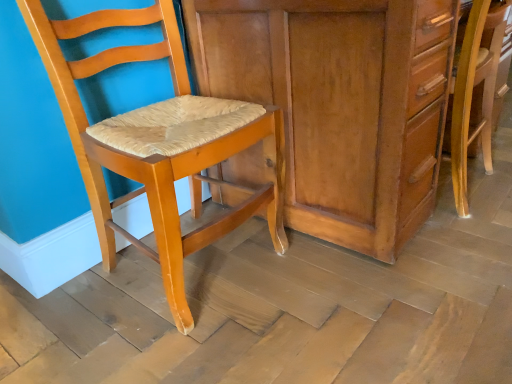
Question: Is matte wood chair at left, positioned as the second chair in right-to-left order, at the left side of wooden chair at right, the first chair in the right-to-left sequence?

Choices:
 (A) no
 (B) yes

Answer: (B)

Question: Is matte wood chair at left, the 1th chair when ordered from left to right, positioned beyond the bounds of wooden chair at right, the first chair in the right-to-left sequence?

Choices:
 (A) yes
 (B) no

Answer: (A)

Question: Can you confirm if matte wood chair at left, the 1th chair when ordered from left to right, is wider than wooden chair at right, acting as the 2th chair starting from the left?

Choices:
 (A) yes
 (B) no

Answer: (A)

Question: Does matte wood chair at left, the 1th chair when ordered from left to right, have a lesser height compared to wooden chair at right, acting as the 2th chair starting from the left?

Choices:
 (A) yes
 (B) no

Answer: (B)

Question: Does matte wood chair at left, positioned as the second chair in right-to-left order, lie in front of wooden chair at right, acting as the 2th chair starting from the left?

Choices:
 (A) yes
 (B) no

Answer: (A)

Question: Does matte wood chair at left, positioned as the second chair in right-to-left order, have a greater height compared to wooden chair at right, the first chair in the right-to-left sequence?

Choices:
 (A) no
 (B) yes

Answer: (B)

Question: Is wooden chair at right, the first chair in the right-to-left sequence, at the right side of matte wood cabinet at center?

Choices:
 (A) no
 (B) yes

Answer: (B)

Question: Is wooden chair at right, acting as the 2th chair starting from the left, looking in the opposite direction of matte wood cabinet at center?

Choices:
 (A) no
 (B) yes

Answer: (B)

Question: Is wooden chair at right, acting as the 2th chair starting from the left, surrounding matte wood cabinet at center?

Choices:
 (A) yes
 (B) no

Answer: (B)

Question: Does wooden chair at right, the first chair in the right-to-left sequence, have a larger size compared to matte wood cabinet at center?

Choices:
 (A) no
 (B) yes

Answer: (A)

Question: Can you confirm if wooden chair at right, acting as the 2th chair starting from the left, is taller than matte wood cabinet at center?

Choices:
 (A) yes
 (B) no

Answer: (B)

Question: Considering the relative sizes of wooden chair at right, acting as the 2th chair starting from the left, and matte wood cabinet at center in the image provided, is wooden chair at right, acting as the 2th chair starting from the left, wider than matte wood cabinet at center?

Choices:
 (A) no
 (B) yes

Answer: (A)

Question: Can you see matte wood cabinet at center touching matte wood chair at left, positioned as the second chair in right-to-left order?

Choices:
 (A) yes
 (B) no

Answer: (B)